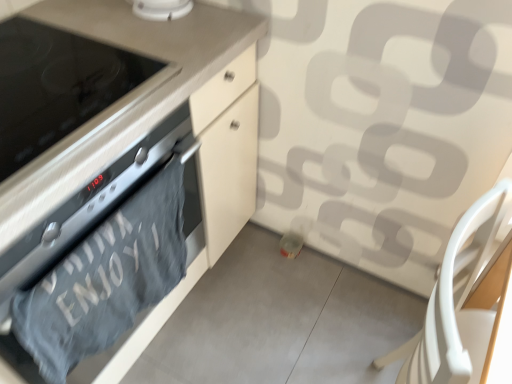
This screenshot has height=384, width=512. Describe the element at coordinates (131, 141) in the screenshot. I see `matte black oven at left` at that location.

You are a GUI agent. You are given a task and a screenshot of the screen. Output one action in this format:
    pyautogui.click(x=<x>, y=<y>)
    Task: Click on the white plastic chair at lower right
    Image resolution: width=512 pixels, height=384 pixels.
    Given the screenshot: What is the action you would take?
    pyautogui.click(x=467, y=305)

Describe the element at coordinates (56, 86) in the screenshot. I see `black glass stove at left` at that location.

Find the location of `white glossy smoke detector at upper center`. white glossy smoke detector at upper center is located at coordinates (161, 9).

This screenshot has width=512, height=384. Find the location of `matte black oven at left`. matte black oven at left is located at coordinates (131, 141).

From a real-world perspective, is white plastic chair at lower right physically above black glass stove at left?

No.

Is white plastic chair at lower right bigger or smaller than black glass stove at left?

Clearly, white plastic chair at lower right is larger in size than black glass stove at left.

Can you confirm if white plastic chair at lower right is positioned to the left of black glass stove at left?

In fact, white plastic chair at lower right is to the right of black glass stove at left.

From a real-world perspective, is gray cotton towel at lower left below black glass stove at left?

Yes, from a real-world perspective, gray cotton towel at lower left is under black glass stove at left.

Considering the sizes of objects gray cotton towel at lower left and black glass stove at left in the image provided, who is bigger, gray cotton towel at lower left or black glass stove at left?

black glass stove at left is bigger.

Does point (104, 252) come behind point (160, 64)?

No, it is not.

Does gray cotton towel at lower left contain black glass stove at left?

No.

Does gray cotton towel at lower left turn towards matte black oven at left?

Yes.

Looking at this image, which object is closer to the camera taking this photo, gray cotton towel at lower left or matte black oven at left?

matte black oven at left is closer to the camera.

Can you confirm if gray cotton towel at lower left is thinner than matte black oven at left?

Yes, gray cotton towel at lower left is thinner than matte black oven at left.

Which object is thinner, white glossy smoke detector at upper center or gray cotton towel at lower left?

With smaller width is gray cotton towel at lower left.

Where is `bath towel lying in front of the white glossy smoke detector at upper center`? bath towel lying in front of the white glossy smoke detector at upper center is located at coordinates [x=106, y=279].

Looking at this image, from the image's perspective, which object appears higher, white glossy smoke detector at upper center or gray cotton towel at lower left?

white glossy smoke detector at upper center.

Would you consider white glossy smoke detector at upper center to be distant from gray cotton towel at lower left?

That's not correct — white glossy smoke detector at upper center is a little close to gray cotton towel at lower left.

Is matte black oven at left located outside white glossy smoke detector at upper center?

Absolutely, matte black oven at left is external to white glossy smoke detector at upper center.

Between matte black oven at left and white glossy smoke detector at upper center, which one is positioned behind?

Positioned behind is white glossy smoke detector at upper center.

In the scene shown: Is matte black oven at left turned away from white glossy smoke detector at upper center?

No, white glossy smoke detector at upper center is not at the back of matte black oven at left.

Looking at this image, is matte black oven at left further to camera compared to black glass stove at left?

No, matte black oven at left is closer to the viewer.

In the scene shown: Can you confirm if matte black oven at left is taller than black glass stove at left?

Yes.

Is matte black oven at left oriented away from black glass stove at left?

matte black oven at left does not have its back to black glass stove at left.

Is matte black oven at left beside black glass stove at left?

matte black oven at left and black glass stove at left are clearly separated.

From a real-world perspective, does white glossy smoke detector at upper center sit lower than white plastic chair at lower right?

No, from a real-world perspective, white glossy smoke detector at upper center is not under white plastic chair at lower right.

Which object is thinner, white glossy smoke detector at upper center or white plastic chair at lower right?

white glossy smoke detector at upper center is thinner.

Find the location of a particular element. The height and width of the screenshot is (384, 512). chair directly beneath the white glossy smoke detector at upper center (from a real-world perspective) is located at coordinates (467, 305).

In the scene shown: Considering the positions of objects white glossy smoke detector at upper center and white plastic chair at lower right in the image provided, who is in front, white glossy smoke detector at upper center or white plastic chair at lower right?

white plastic chair at lower right is more forward.

The width and height of the screenshot is (512, 384). I want to click on home appliance located above the white plastic chair at lower right (from a real-world perspective), so click(x=56, y=86).

What are the coordinates of `bath towel that appears below the black glass stove at left (from a real-world perspective)` in the screenshot? It's located at (106, 279).

From the image, which object appears to be farther from white glossy smoke detector at upper center, gray cotton towel at lower left or white plastic chair at lower right?

white plastic chair at lower right lies further to white glossy smoke detector at upper center than the other object.

From the picture: From the image, which object appears to be nearer to matte black oven at left, white glossy smoke detector at upper center or white plastic chair at lower right?

white glossy smoke detector at upper center lies closer to matte black oven at left than the other object.

Based on their spatial positions, is black glass stove at left or gray cotton towel at lower left closer to matte black oven at left?

The object closer to matte black oven at left is black glass stove at left.

Based on their spatial positions, is black glass stove at left or gray cotton towel at lower left further from white glossy smoke detector at upper center?

Based on the image, gray cotton towel at lower left appears to be further to white glossy smoke detector at upper center.

When comparing their distances from white plastic chair at lower right, does black glass stove at left or white glossy smoke detector at upper center seem further?

white glossy smoke detector at upper center is further to white plastic chair at lower right.

Looking at the image, which one is located further to matte black oven at left, gray cotton towel at lower left or white glossy smoke detector at upper center?

Among the two, white glossy smoke detector at upper center is located further to matte black oven at left.

Estimate the real-world distances between objects in this image. Which object is further from white plastic chair at lower right, matte black oven at left or gray cotton towel at lower left?

The object further to white plastic chair at lower right is matte black oven at left.

When comparing their distances from gray cotton towel at lower left, does matte black oven at left or black glass stove at left seem closer?

matte black oven at left lies closer to gray cotton towel at lower left than the other object.

Locate an element on the screen. This screenshot has width=512, height=384. kitchen appliance between matte black oven at left and white plastic chair at lower right is located at coordinates (161, 9).

Find the location of a particular element. This screenshot has width=512, height=384. home appliance between matte black oven at left and white plastic chair at lower right from left to right is located at coordinates (56, 86).

Find the location of a particular element. home appliance between white glossy smoke detector at upper center and matte black oven at left in the vertical direction is located at coordinates (56, 86).

I want to click on bath towel between white glossy smoke detector at upper center and white plastic chair at lower right from top to bottom, so click(106, 279).